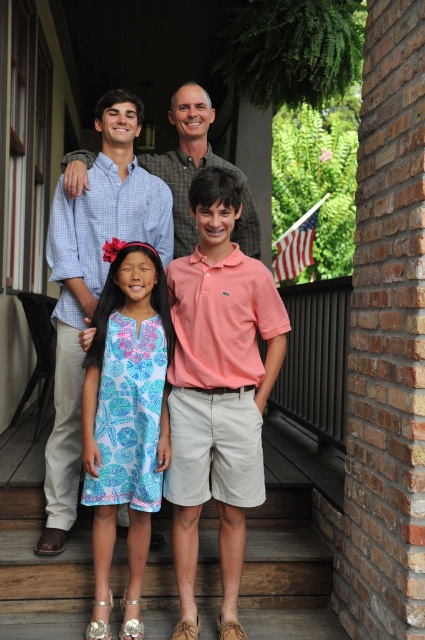
You are a photographer setting up for a family portrait. You need to adjust the lighting so that the brushed metal shirt at upper center and the blue floral dress at center are both well lit. Which object should you focus the light on first to ensure proper exposure?

The blue floral dress at center should be focused on first because the brushed metal shirt at upper center is below it, so adjusting the light for the dress will naturally illuminate the shirt as well.

You are a photographer trying to capture a candid shot of the family. You notice the blue floral dress at center and the matte plaid shirt at upper center in your viewfinder. Based on their heights, which clothing item would you focus on to ensure the subject wearing it is fully visible in the frame?

The blue floral dress at center is shorter than the matte plaid shirt at upper center. Therefore, focusing on the matte plaid shirt at upper center would ensure the subject wearing it is fully visible since it is taller.